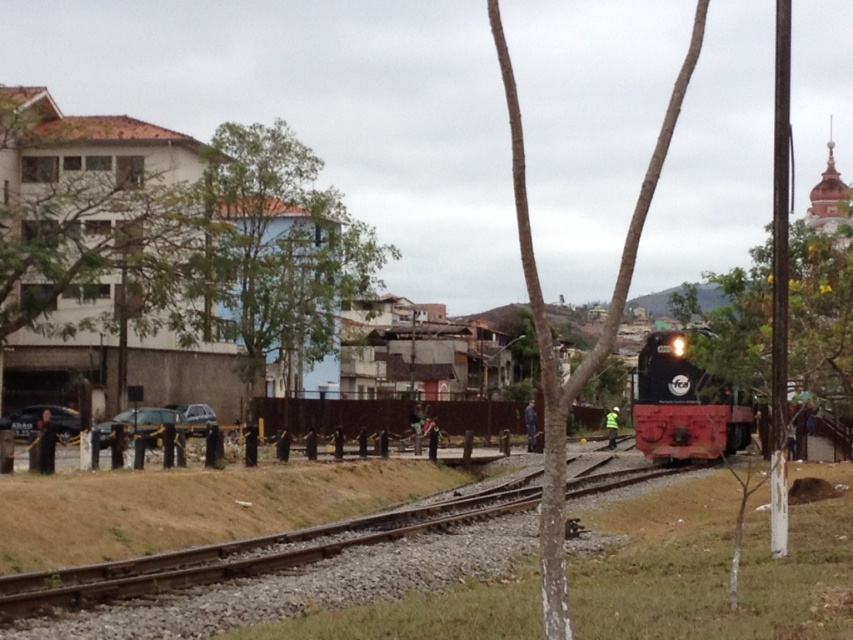
Question: Can you confirm if green leafy tree at right is positioned to the left of shiny black locomotive at center?

Choices:
 (A) no
 (B) yes

Answer: (A)

Question: Estimate the real-world distances between objects in this image. Which object is farther from the smooth bark tree at center?

Choices:
 (A) metal train track at center
 (B) shiny black locomotive at center
 (C) green leafy tree at upper left

Answer: (C)

Question: Which point is closer to the camera taking this photo?

Choices:
 (A) (801, 392)
 (B) (675, 106)
 (C) (689, 417)
 (D) (215, 220)

Answer: (A)

Question: Which object is positioned closest to the metal train track at center?

Choices:
 (A) smooth bark tree at center
 (B) green leafy tree at upper left
 (C) green leafy tree at right

Answer: (C)

Question: Is green leafy tree at right thinner than shiny black locomotive at center?

Choices:
 (A) yes
 (B) no

Answer: (B)

Question: Can you confirm if green leafy tree at right is thinner than smooth bark tree at center?

Choices:
 (A) no
 (B) yes

Answer: (B)